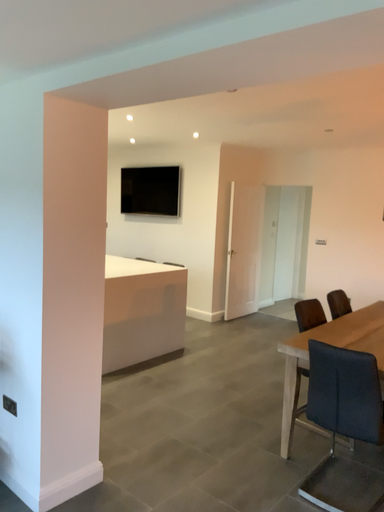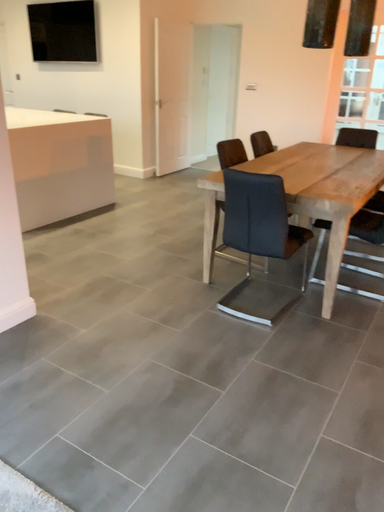
Question: Which way did the camera rotate in the video?

Choices:
 (A) rotated upward
 (B) rotated downward

Answer: (B)